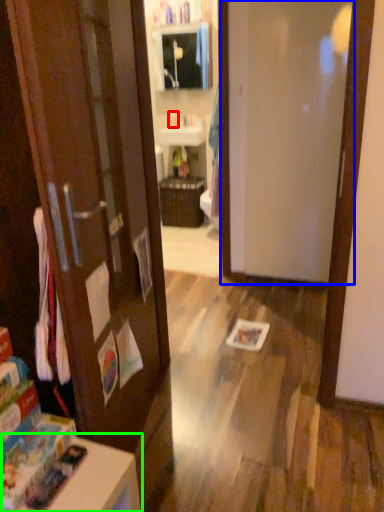
Question: Which is farther away from toiletry (highlighted by a red box)? door (highlighted by a blue box) or table (highlighted by a green box)?

Choices:
 (A) door
 (B) table

Answer: (B)